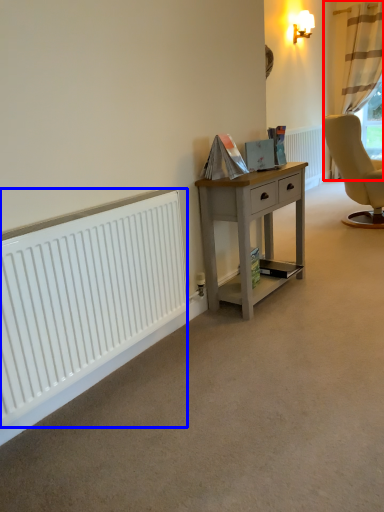
Question: Which of the following is the farthest to the observer, curtain (highlighted by a red box) or radiator (highlighted by a blue box)?

Choices:
 (A) curtain
 (B) radiator

Answer: (A)